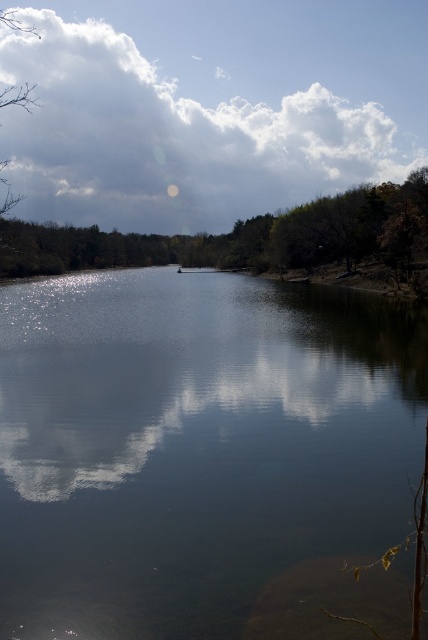
You are a photographer planning to take a landscape photo of the serene lakeside scene. You want to ensure that both the clear water at center and the green matte tree at upper center are visible in your shot. Based on their sizes in the image, which object should you focus on to frame the photo properly?

The clear water at center is thinner than the green matte tree at upper center, so you should focus on the green matte tree at upper center to frame the photo properly as it is wider.

You are an artist painting the lakeside scene. You want to ensure the white fluffy cloud at upper center and the green matte tree at upper center are proportionally accurate. Which one should you draw taller in your painting?

The white fluffy cloud at upper center has a greater height compared to the green matte tree at upper center, so you should draw the white fluffy cloud at upper center taller than the green matte tree at upper center in your painting.

You are standing on the lakeside and want to take a photo of the clear water at center and the green matte tree at upper center. Which object will appear closer to the camera in the photo?

The clear water at center will appear closer to the camera in the photo because it is positioned in front of the green matte tree at upper center.